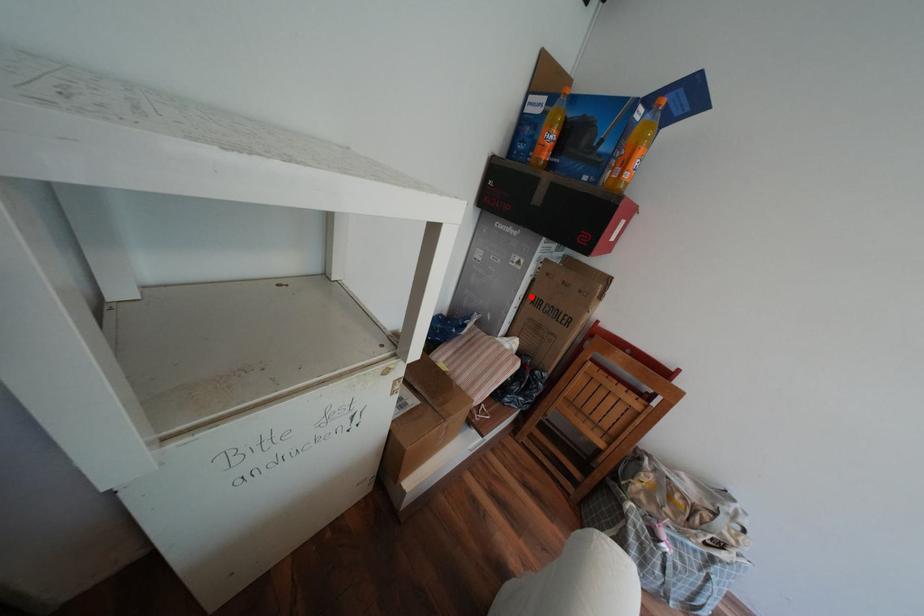
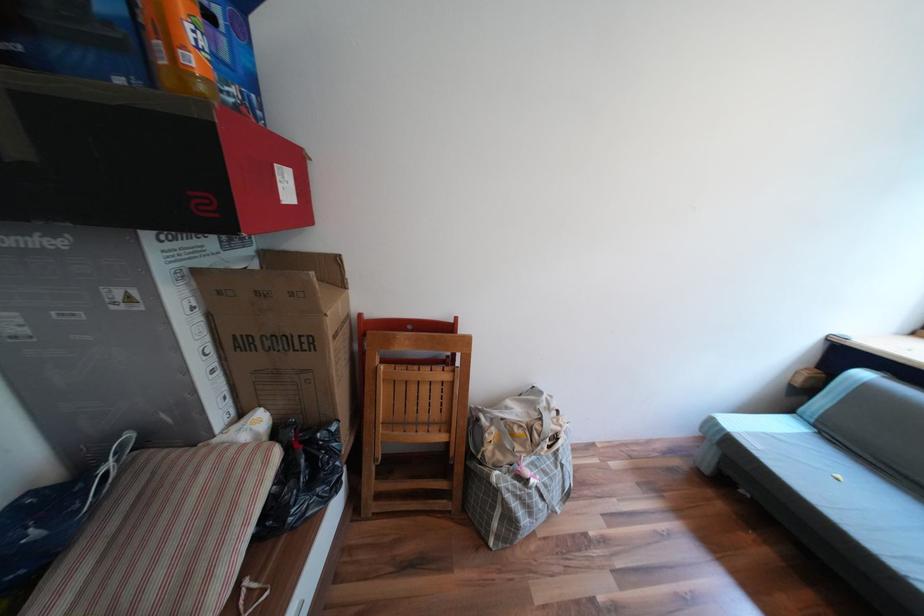
Where in the second image is the point corresponding to the highlighted location from the first image?

(219, 349)